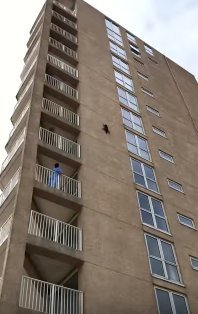
Find the location of a particular element. This screenshot has height=314, width=198. white frame of window is located at coordinates (162, 257).